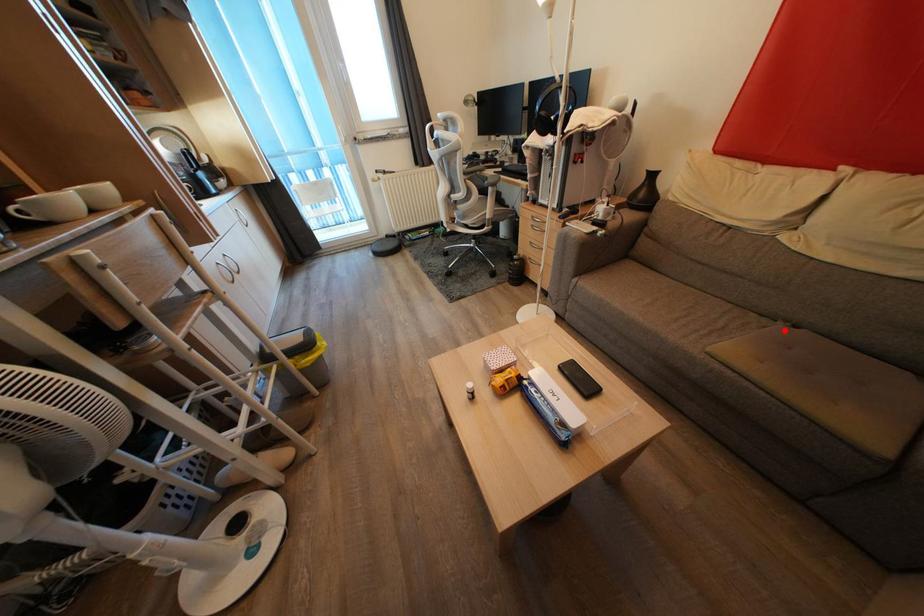
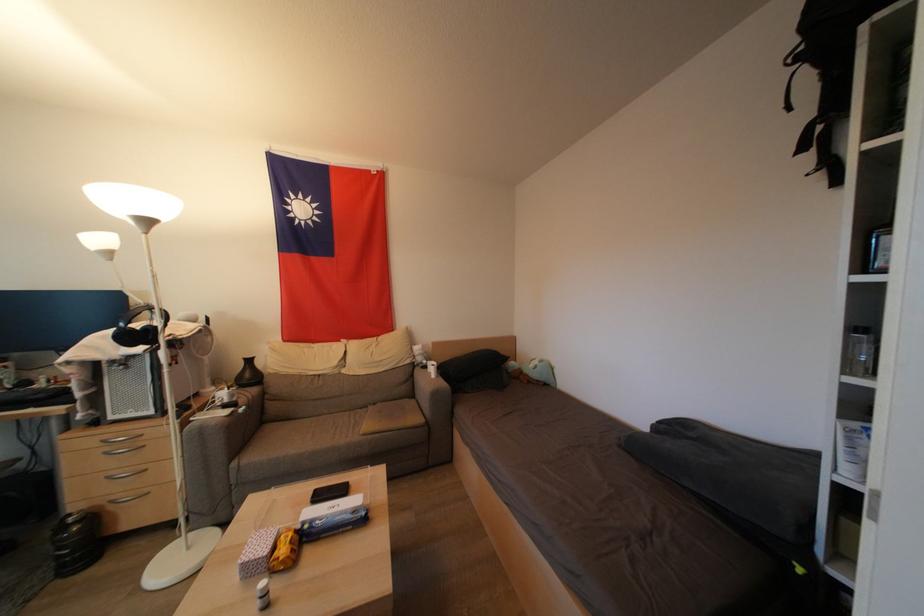
The point at the highlighted location is marked in the first image. Where is the corresponding point in the second image?

(375, 411)